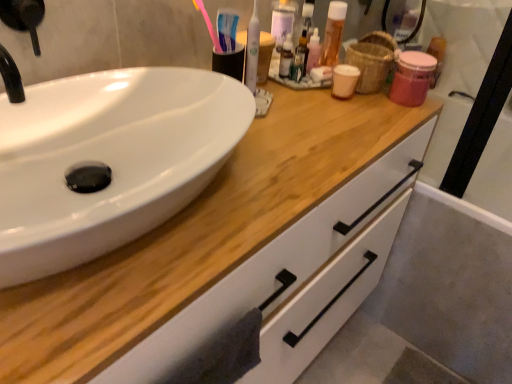
Locate an element on the screen. vacant space in front of translucent plastic mouthwash at upper center, which is the 2th mouthwash in left-to-right order is located at coordinates (367, 113).